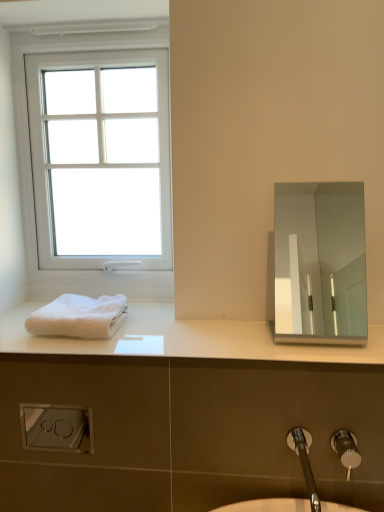
Question: Is white plastic window at upper left situated inside white fluffy towel at lower left or outside?

Choices:
 (A) inside
 (B) outside

Answer: (B)

Question: Considering their positions, is white plastic window at upper left located in front of or behind white fluffy towel at lower left?

Choices:
 (A) front
 (B) behind

Answer: (B)

Question: Estimate the real-world distances between objects in this image. Which object is closer to the white plastic window at upper left?

Choices:
 (A) polished silver mirror at upper right
 (B) white matte towel at left
 (C) chrome metallic tap at lower right
 (D) white fluffy towel at lower left
 (E) brushed metal faucet at lower right

Answer: (D)

Question: Considering the real-world distances, which object is closest to the brushed metal faucet at lower right?

Choices:
 (A) white fluffy towel at lower left
 (B) white matte towel at left
 (C) polished silver mirror at upper right
 (D) white plastic window at upper left
 (E) chrome metallic tap at lower right

Answer: (E)